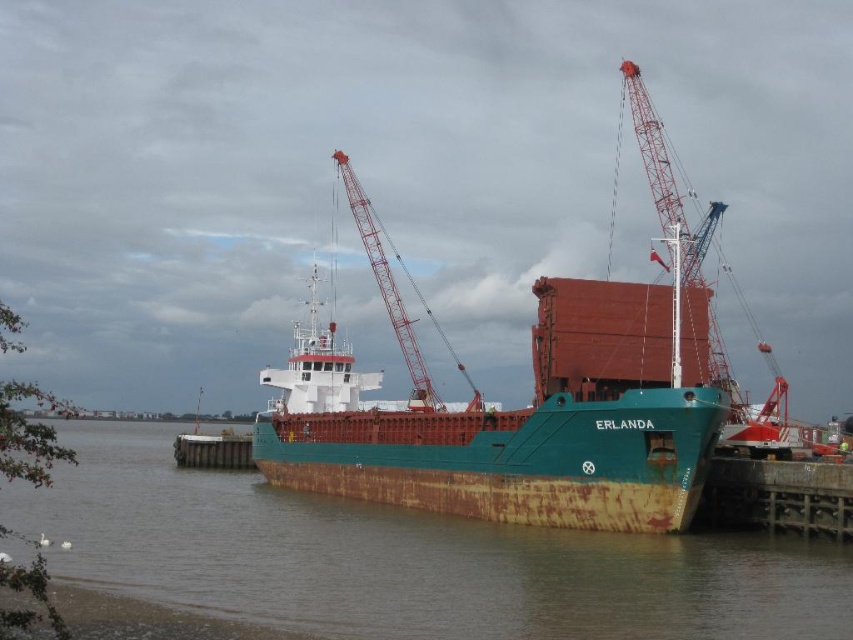
You are a port worker who needs to secure a large container onto the top of the ERLANDA ship. You have two cranes available, the red metal crane at upper center and the rusty metal crane at center. Which crane would you use to reach the highest point of the ship?

The red metal crane at upper center is much taller than the rusty metal crane at center, so you should use the red metal crane at upper center to reach the highest point of the ship.

You are standing on the deck of the ERLANDA cargo ship and looking at two points marked on the ship. The first point is at coordinates point (68,554) and the second is at point (396,326). Which point is closer to you?

Point (68,554) is closer to the viewer than point (396,326).